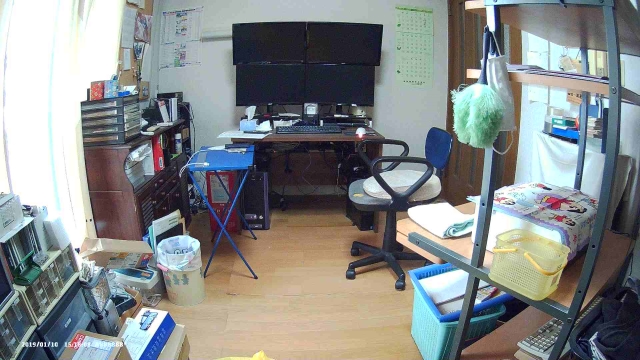
Identify the location of rack. (612, 158).